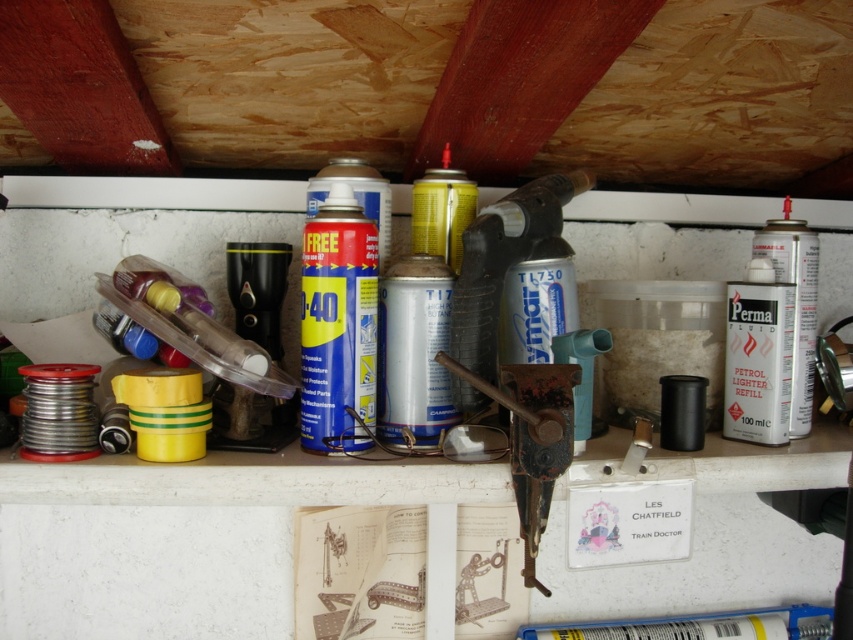
Does blue metallic spray can at center have a lesser height compared to yellow matte spray can at center?

No, blue metallic spray can at center is not shorter than yellow matte spray can at center.

Is blue metallic spray can at center further to camera compared to yellow matte spray can at center?

No.

The image size is (853, 640). What do you see at coordinates (338, 323) in the screenshot? I see `blue metallic spray can at center` at bounding box center [338, 323].

I want to click on blue metallic spray can at center, so click(x=338, y=323).

Measure the distance from blue metallic spray can at center to silver metallic spray can at center.

blue metallic spray can at center and silver metallic spray can at center are 1.95 inches apart from each other.

Does point (341, 232) come closer to viewer compared to point (415, 266)?

Yes.

Where is `blue metallic spray can at center`? This screenshot has width=853, height=640. blue metallic spray can at center is located at coordinates (338, 323).

Is the position of silver metallic spray can at center more distant than that of yellow matte spray can at center?

No, it is in front of yellow matte spray can at center.

Between silver metallic spray can at center and yellow matte spray can at center, which one has more height?

silver metallic spray can at center is taller.

Who is more distant from viewer, [427,291] or [463,220]?

The point [463,220] is behind.

You are a GUI agent. You are given a task and a screenshot of the screen. Output one action in this format:
    pyautogui.click(x=<x>, y=<y>)
    Task: Click on the silver metallic spray can at center
    The image size is (853, 640).
    Given the screenshot: What is the action you would take?
    pyautogui.click(x=413, y=349)